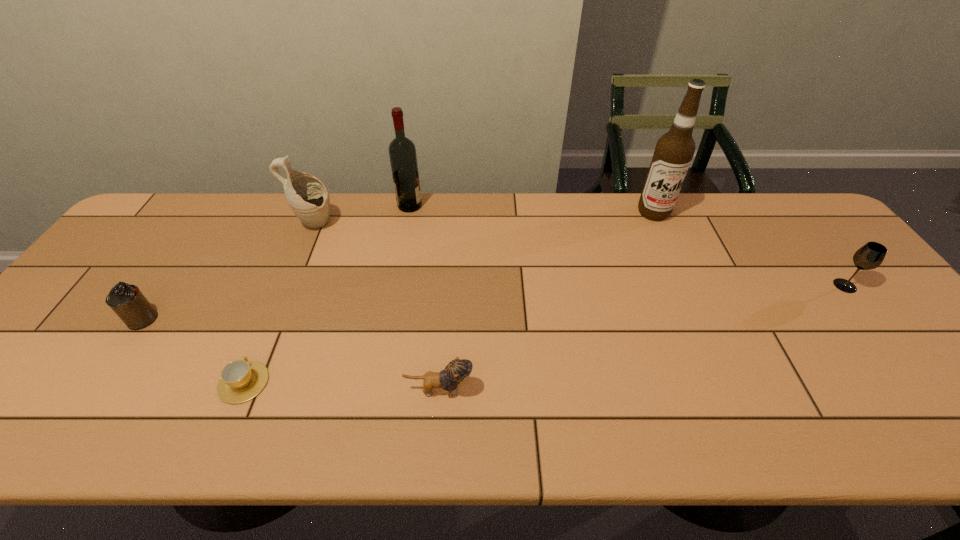
Identify the location of cup. This screenshot has width=960, height=540. (241, 380).

Locate an element on the screen. The height and width of the screenshot is (540, 960). vacant space situated 0.090m on the label of the tallest object is located at coordinates (666, 242).

Image resolution: width=960 pixels, height=540 pixels. In order to click on free space located on the front and back of the second tallest object in this screenshot , I will do 521,206.

At what (x,y) coordinates should I click in order to perform the action: click on free space located 0.290m at the spout of the fifth shortest object. Please return your answer as a coordinate pair (x, y). Looking at the image, I should click on (430, 225).

Locate an element on the screen. free space located 0.190m on the left of the fourth tallest object is located at coordinates (763, 286).

Locate an element on the screen. Image resolution: width=960 pixels, height=540 pixels. free region located on the back of the can is located at coordinates (214, 214).

This screenshot has width=960, height=540. Identify the location of free space located on the front-facing side of the kitten. (564, 389).

At what (x,y) coordinates should I click in order to perform the action: click on free spot located 0.170m with the handle on the side of the cup. Please return your answer as a coordinate pair (x, y). This screenshot has height=540, width=960. Looking at the image, I should click on (276, 306).

In order to click on vacant space positioned with the handle on the side of the cup in this screenshot , I will do `click(301, 246)`.

You are a GUI agent. You are given a task and a screenshot of the screen. Output one action in this format:
    pyautogui.click(x=<x>, y=<y>)
    Task: Click on the blank space located with the handle on the side of the cup
    Image resolution: width=960 pixels, height=540 pixels.
    Given the screenshot: What is the action you would take?
    click(264, 334)